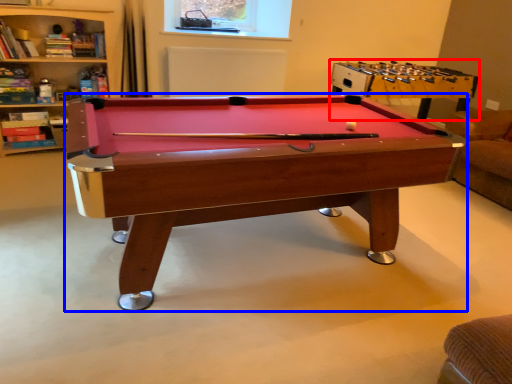
Question: Among these objects, which one is farthest to the camera, table (highlighted by a red box) or billiard table (highlighted by a blue box)?

Choices:
 (A) table
 (B) billiard table

Answer: (A)